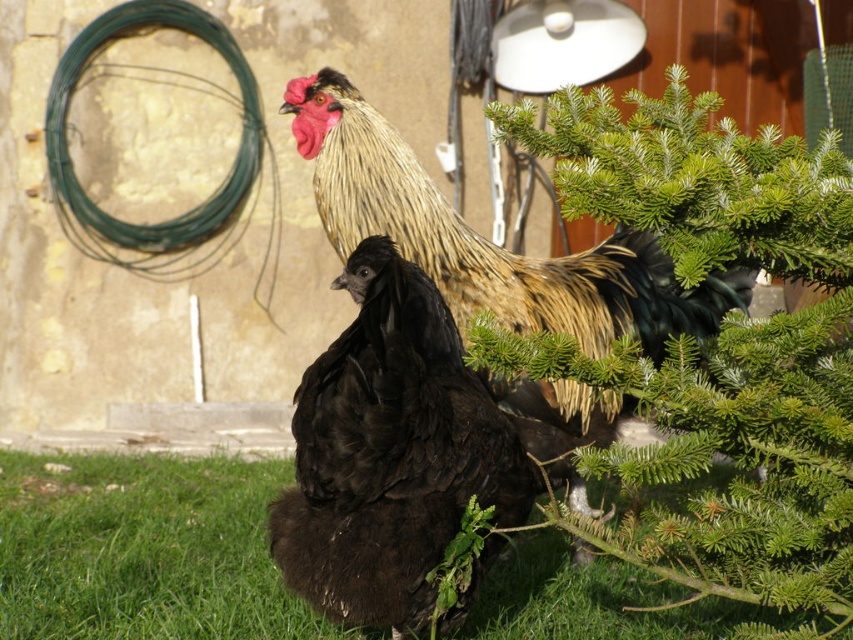
Is green soft grass at lower left bigger than black feathered chicken at center?

Indeed, green soft grass at lower left has a larger size compared to black feathered chicken at center.

Describe the element at coordinates (143, 548) in the screenshot. I see `green soft grass at lower left` at that location.

Where is `green soft grass at lower left`? The image size is (853, 640). green soft grass at lower left is located at coordinates (143, 548).

Find the location of a particular element. green soft grass at lower left is located at coordinates (143, 548).

Is point (323, 412) positioned after point (642, 304)?

No, (323, 412) is closer to viewer.

Does black feathered chicken at center have a lesser width compared to black feathered rooster at center?

Yes, black feathered chicken at center is thinner than black feathered rooster at center.

Between point (389, 433) and point (358, 218), which one is positioned in front?

Point (389, 433) is in front.

Locate an element on the screen. black feathered chicken at center is located at coordinates (390, 452).

Is green needle-like leaves at center right wider than black feathered rooster at center?

No.

Who is lower down, green needle-like leaves at center right or black feathered rooster at center?

green needle-like leaves at center right is lower down.

The width and height of the screenshot is (853, 640). What are the coordinates of `green needle-like leaves at center right` in the screenshot? It's located at (717, 346).

Locate an element on the screen. The image size is (853, 640). green needle-like leaves at center right is located at coordinates (717, 346).